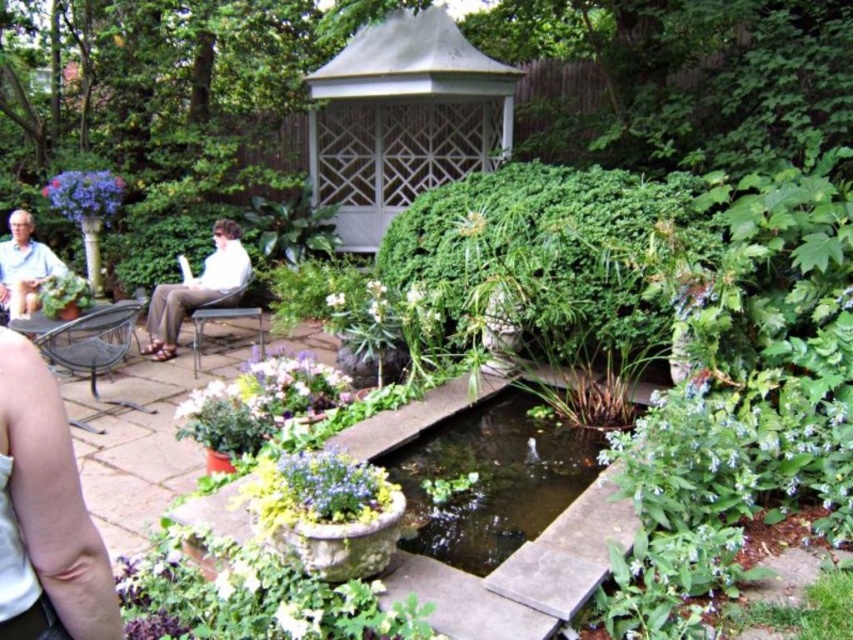
You are a gardener standing in front of the pond and want to water the matte purple flowers at center and matte purple flowers at upper left. Which one do you need to move closer to first to reach with your watering can?

The matte purple flowers at center is closer to the viewer than matte purple flowers at upper left, so you should water the matte purple flowers at center first since it is nearer to you.

You are standing at the entrance of the garden and want to reach the white lattice gazebo at center. According to the coordinates provided, is the gazebo positioned closer to the top or bottom of the image?

The white lattice gazebo at center is located at point 0.188 on the x and 0.472 on the y. Since the y coordinate is closer to 0.5, it is positioned closer to the bottom of the image.